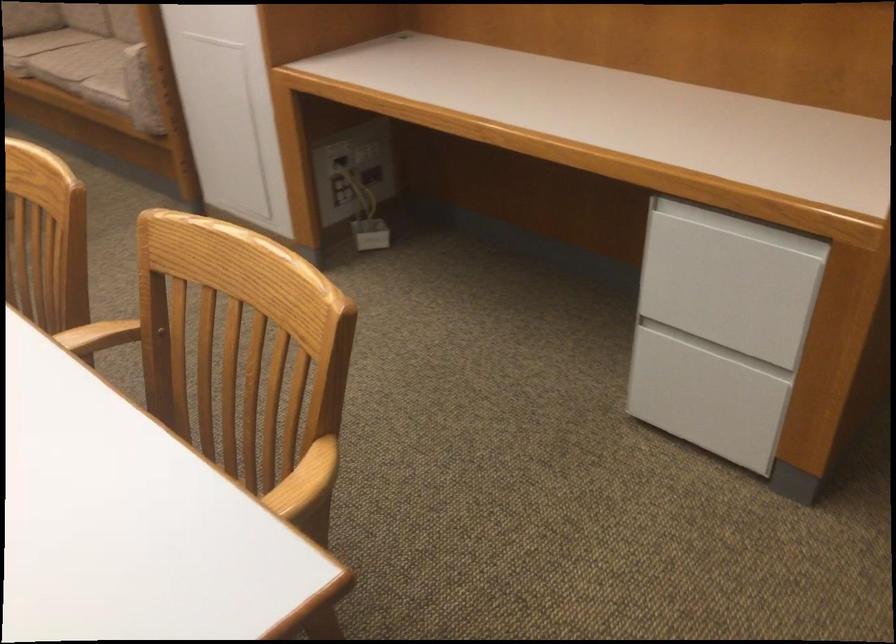
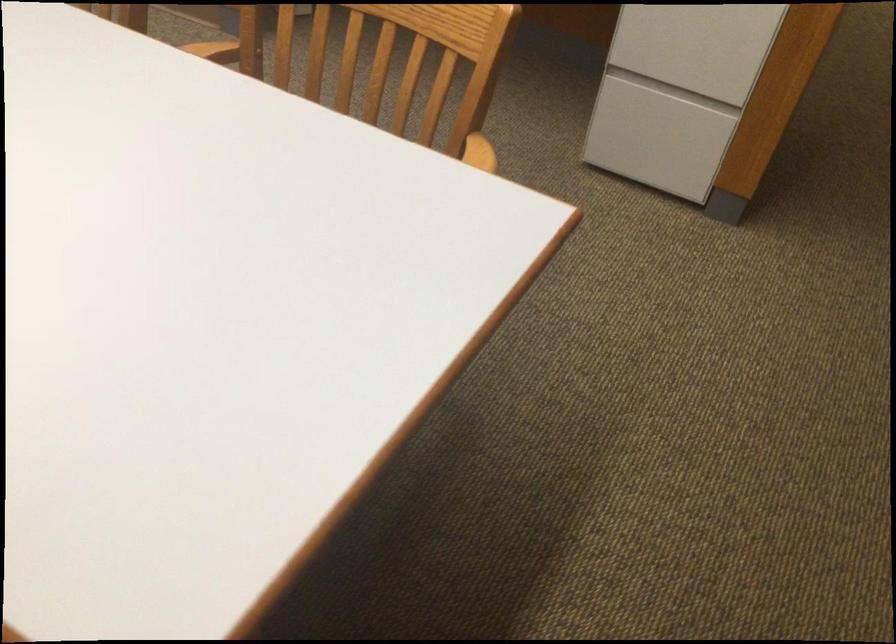
Question: What movement of the cameraman would produce the second image?

Choices:
 (A) Left
 (B) Right
 (C) Forward
 (D) Backward

Answer: (A)